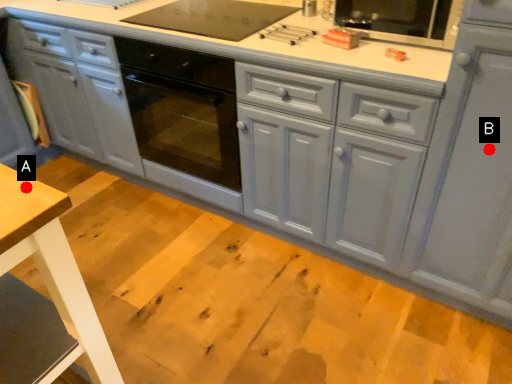
Question: Two points are circled on the image, labeled by A and B beside each circle. Which point is closer to the camera?

Choices:
 (A) A is closer
 (B) B is closer

Answer: (A)